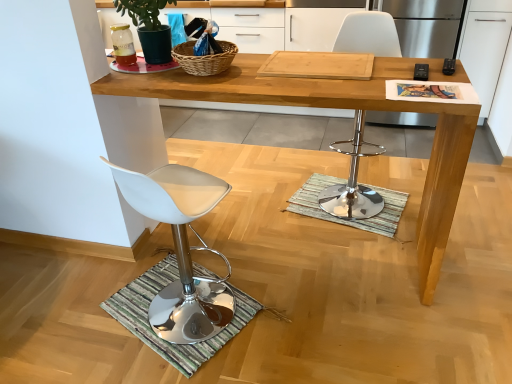
Question: Relative to black plastic remote control at upper right, marked as the first remote control in a left-to-right arrangement, is green striped mat at lower left, which is the 2th doormat from top to bottom, in front or behind?

Choices:
 (A) front
 (B) behind

Answer: (B)

Question: From a real-world perspective, relative to black plastic remote control at upper right, which is the second remote control from right to left, is green striped mat at lower left, marked as the first doormat in a front-to-back arrangement, vertically above or below?

Choices:
 (A) below
 (B) above

Answer: (A)

Question: Which object is positioned farthest from the wooden desk at center?

Choices:
 (A) white plastic chair at lower left, which is the second chair in right-to-left order
 (B) woven brown picnic basket at upper center
 (C) black plastic remote control at upper right, which is the second remote control from right to left
 (D) green matte plant at upper left
 (E) striped fabric doormat at center, positioned as the second doormat in front-to-back order

Answer: (A)

Question: Based on their relative distances, which object is farther from the black plastic remote control at upper right, which is the second remote control from right to left?

Choices:
 (A) striped fabric doormat at center, the 1th doormat in the back-to-front sequence
 (B) green striped mat at lower left, placed as the 2th doormat when sorted from right to left
 (C) white plastic chair at lower left, which is the second chair in right-to-left order
 (D) woven brown picnic basket at upper center
 (E) chrome metallic bar stool at center, which is the 1th chair from right to left

Answer: (B)